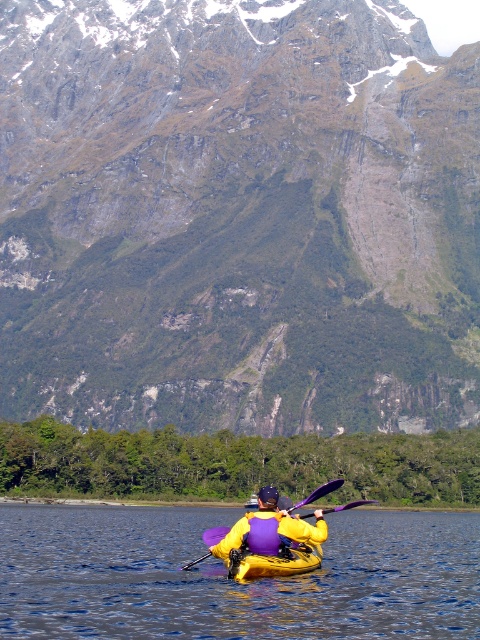
You are standing on the shore of the lake and see the green rock at upper center and the blue water at center. Which object is higher in elevation?

The green rock at upper center is higher in elevation than the blue water at center because it is positioned above it.

You are standing at the edge of the water in the serene outdoor scene and want to reach a specific point marked at coordinates point (x=310, y=349). If your kayak can travel at a speed of 2 meters per second, how long will it take you to reach that point?

The distance between you and point (x=310, y=349) is 575.07 meters. At a speed of 2 meters per second, it would take approximately 287.54 seconds, which is roughly 4 minutes and 48 seconds, to reach the point.

You are a drone operator trying to capture the blue water at center in the image. The drone is currently at point (230, 579). Is the drone positioned directly over the blue water at center?

Yes, the blue water at center is located at point (230, 579), so the drone is positioned directly over the blue water at center.